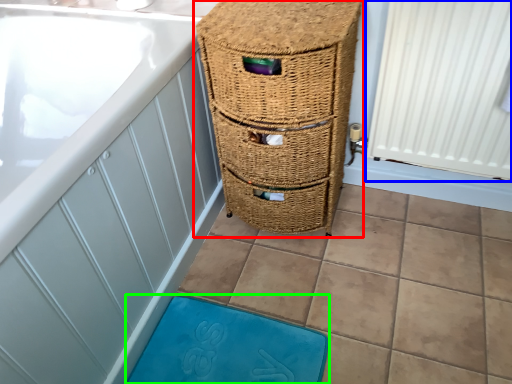
Question: Considering the real-world distances, which object is closest to furniture (highlighted by a red box)? radiator (highlighted by a blue box) or bath mat (highlighted by a green box).

Choices:
 (A) radiator
 (B) bath mat

Answer: (A)